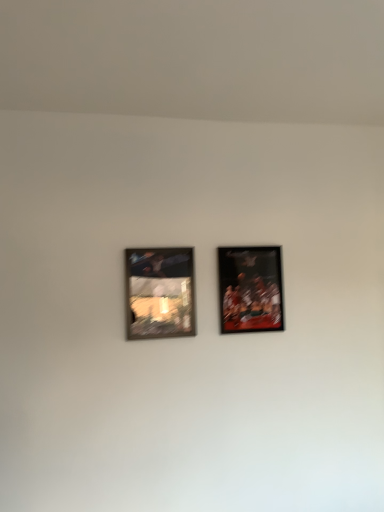
Question: Can you confirm if wooden frame at left, the 1th picture frame from the left, is bigger than matte black picture frame at right, marked as the first picture frame in a right-to-left arrangement?

Choices:
 (A) yes
 (B) no

Answer: (B)

Question: Does wooden frame at left, the second picture frame in the right-to-left sequence, lie in front of matte black picture frame at right, marked as the first picture frame in a right-to-left arrangement?

Choices:
 (A) no
 (B) yes

Answer: (B)

Question: Is wooden frame at left, the 1th picture frame from the left, directly adjacent to matte black picture frame at right, the 2th picture frame positioned from the left?

Choices:
 (A) no
 (B) yes

Answer: (A)

Question: From the image's perspective, is wooden frame at left, the 1th picture frame from the left, on matte black picture frame at right, marked as the first picture frame in a right-to-left arrangement?

Choices:
 (A) yes
 (B) no

Answer: (B)

Question: Considering the relative sizes of wooden frame at left, the second picture frame in the right-to-left sequence, and matte black picture frame at right, marked as the first picture frame in a right-to-left arrangement, in the image provided, is wooden frame at left, the second picture frame in the right-to-left sequence, wider than matte black picture frame at right, marked as the first picture frame in a right-to-left arrangement,?

Choices:
 (A) no
 (B) yes

Answer: (A)

Question: Is wooden frame at left, the second picture frame in the right-to-left sequence, further to camera compared to matte black picture frame at right, the 2th picture frame positioned from the left?

Choices:
 (A) yes
 (B) no

Answer: (B)

Question: Considering the relative sizes of matte black picture frame at right, the 2th picture frame positioned from the left, and wooden frame at left, the second picture frame in the right-to-left sequence, in the image provided, is matte black picture frame at right, the 2th picture frame positioned from the left, shorter than wooden frame at left, the second picture frame in the right-to-left sequence,?

Choices:
 (A) yes
 (B) no

Answer: (B)

Question: Are matte black picture frame at right, the 2th picture frame positioned from the left, and wooden frame at left, the 1th picture frame from the left, located far from each other?

Choices:
 (A) no
 (B) yes

Answer: (A)

Question: Is matte black picture frame at right, marked as the first picture frame in a right-to-left arrangement, next to wooden frame at left, the second picture frame in the right-to-left sequence?

Choices:
 (A) yes
 (B) no

Answer: (B)

Question: Is matte black picture frame at right, the 2th picture frame positioned from the left, closer to the viewer compared to wooden frame at left, the second picture frame in the right-to-left sequence?

Choices:
 (A) no
 (B) yes

Answer: (A)

Question: From a real-world perspective, does matte black picture frame at right, the 2th picture frame positioned from the left, sit lower than wooden frame at left, the second picture frame in the right-to-left sequence?

Choices:
 (A) yes
 (B) no

Answer: (B)

Question: Considering the relative sizes of matte black picture frame at right, the 2th picture frame positioned from the left, and wooden frame at left, the 1th picture frame from the left, in the image provided, is matte black picture frame at right, the 2th picture frame positioned from the left, bigger than wooden frame at left, the 1th picture frame from the left,?

Choices:
 (A) no
 (B) yes

Answer: (B)

Question: Choose the correct answer: Is wooden frame at left, the second picture frame in the right-to-left sequence, inside matte black picture frame at right, marked as the first picture frame in a right-to-left arrangement, or outside it?

Choices:
 (A) outside
 (B) inside

Answer: (A)